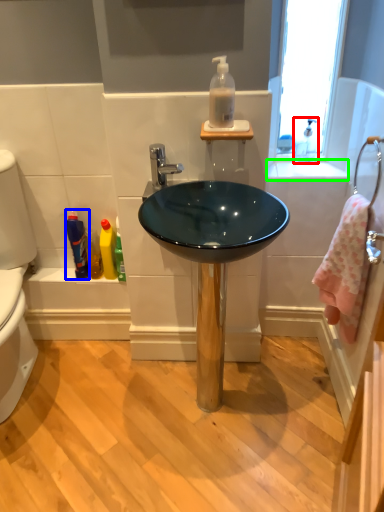
Question: Based on their relative distances, which object is farther from faucet (highlighted by a red box)? Choose from mouthwash (highlighted by a blue box) and counter top (highlighted by a green box).

Choices:
 (A) mouthwash
 (B) counter top

Answer: (A)